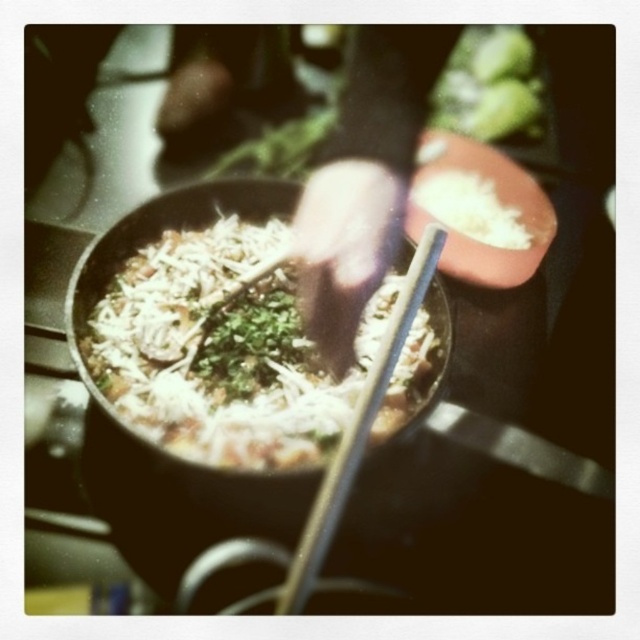
How far apart are green leafy vegetable at upper center and white fluffy rice at center?

14.16 inches

Which is behind, point (486, 76) or point (419, 189)?

Positioned behind is point (486, 76).

Describe the element at coordinates (492, 86) in the screenshot. The image size is (640, 640). I see `green leafy vegetable at upper center` at that location.

Where is `green leafy vegetable at upper center`? The width and height of the screenshot is (640, 640). green leafy vegetable at upper center is located at coordinates (492, 86).

Is point (365, 412) in front of point (442, 104)?

Yes.

Is point (353, 429) positioned behind point (460, 88)?

That is False.

Where is `wooden chopsticks at center`? The image size is (640, 640). wooden chopsticks at center is located at coordinates (358, 428).

Does white shredded cheese at center appear on the left side of green leafy vegetable at upper center?

Yes, white shredded cheese at center is to the left of green leafy vegetable at upper center.

Which is more to the left, white shredded cheese at center or green leafy vegetable at upper center?

white shredded cheese at center is more to the left.

Which is in front, point (256, 394) or point (490, 120)?

Positioned in front is point (256, 394).

Where is `white shredded cheese at center`? white shredded cheese at center is located at coordinates (221, 349).